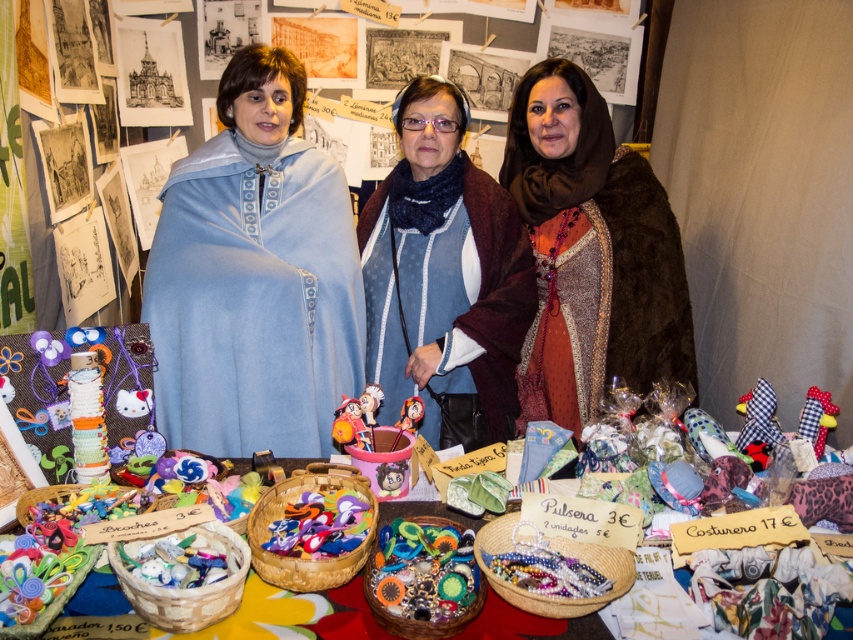
You are standing at the entrance of the craft fair and want to find the multicolored fabric bracelet at center. According to the coordinates provided, where should you look relative to the table?

The multicolored fabric bracelet at center is located at coordinates approximately 0.9 on the x axis and 0.5 on the y axis relative to the table. This places it near the upper right corner of the table.

You are standing in front of the craft fair table and want to pick up an item. If you see two points marked on the table, one at point (281, 115) and another at point (450, 324), which one would be easier to reach without moving your position?

The point at (281, 115) is closer to the camera, so it would be easier to reach without moving your position.

You are a customer at the craft fair and want to determine which item is taller between the brown fur coat at center and the blue woolen scarf at center. Which one is taller?

The brown fur coat at center is taller than the blue woolen scarf at center.